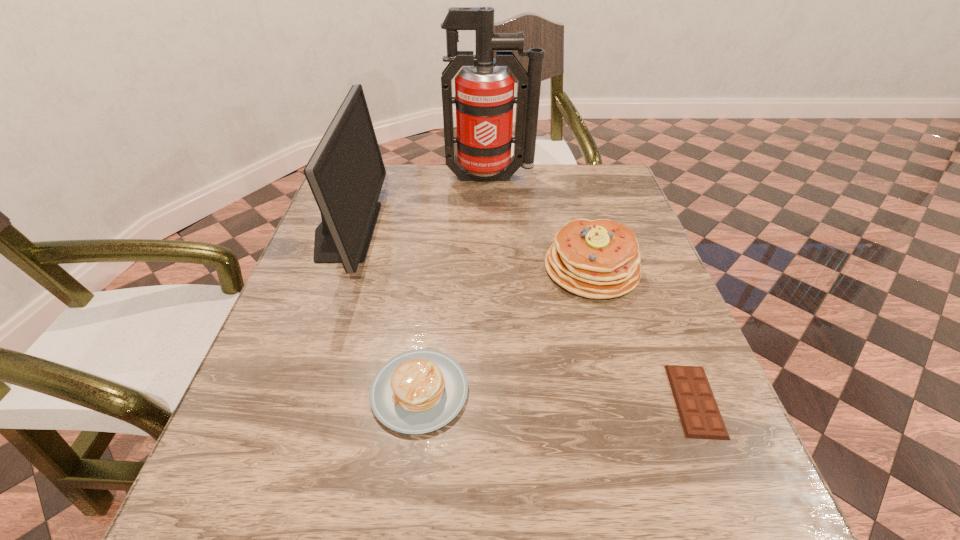
Locate an element on the screen. free space located 0.070m on the front of the right pancake is located at coordinates (608, 328).

The image size is (960, 540). In order to click on vacant space located 0.080m on the front of the left pancake in this screenshot , I will do `click(408, 488)`.

Where is `vacant space located 0.330m on the back of the shortest object`? vacant space located 0.330m on the back of the shortest object is located at coordinates (636, 251).

The image size is (960, 540). Identify the location of fire extinguisher present at the far edge. pos(484,98).

What are the coordinates of `computer monitor positioned at the far edge` in the screenshot? It's located at (346, 172).

At what (x,y) coordinates should I click in order to perform the action: click on object positioned at the left edge. Please return your answer as a coordinate pair (x, y). This screenshot has height=540, width=960. Looking at the image, I should click on (346, 172).

The image size is (960, 540). Identify the location of pancake located in the right edge section of the desktop. (599, 259).

Locate an element on the screen. This screenshot has height=540, width=960. chocolate bar that is at the right edge is located at coordinates (698, 411).

Find the location of `object that is at the far left corner`. object that is at the far left corner is located at coordinates (346, 172).

Where is `vacant position at the far edge of the desktop`? The image size is (960, 540). vacant position at the far edge of the desktop is located at coordinates (413, 164).